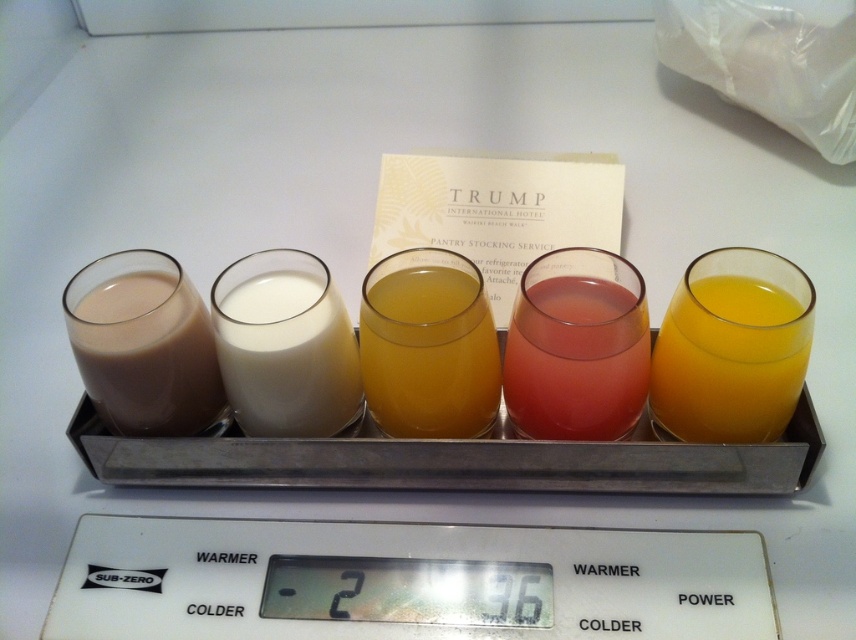
Question: Which point appears closest to the camera in this image?

Choices:
 (A) pyautogui.click(x=437, y=344)
 (B) pyautogui.click(x=200, y=362)
 (C) pyautogui.click(x=242, y=612)
 (D) pyautogui.click(x=694, y=404)

Answer: (A)

Question: Which of the following is the farthest from the observer?

Choices:
 (A) (88, 262)
 (B) (617, 429)

Answer: (A)

Question: Can you confirm if matte brown liquid at left is positioned below translucent orange juice at center?

Choices:
 (A) no
 (B) yes

Answer: (A)

Question: Based on their relative distances, which object is nearer to the translucent pink liquid at center?

Choices:
 (A) translucent orange juice at center
 (B) white creamy milk at center
 (C) matte brown liquid at left

Answer: (A)

Question: Can you confirm if translucent yellow liquid at right is thinner than matte brown liquid at left?

Choices:
 (A) no
 (B) yes

Answer: (B)

Question: Does translucent orange juice at center have a greater width compared to white creamy milk at center?

Choices:
 (A) no
 (B) yes

Answer: (B)